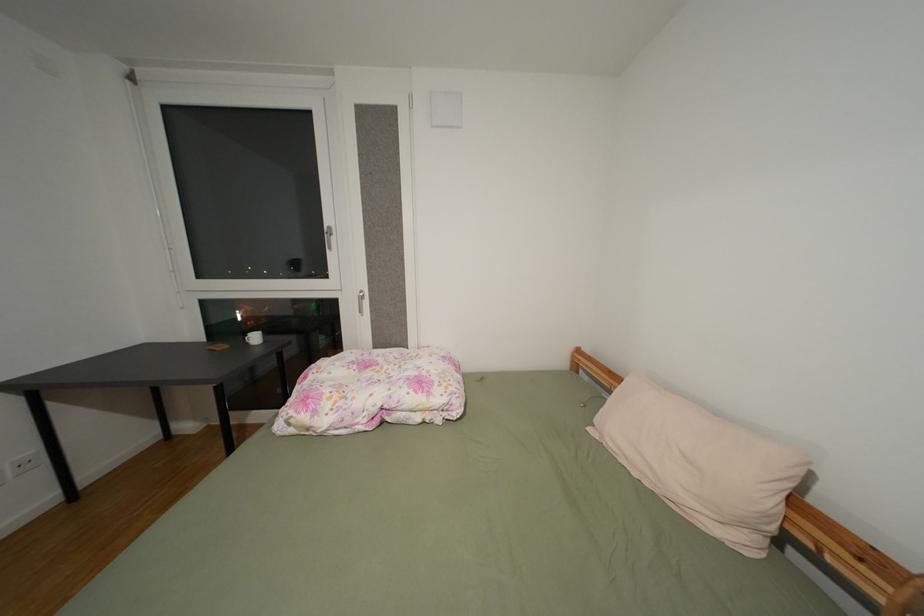
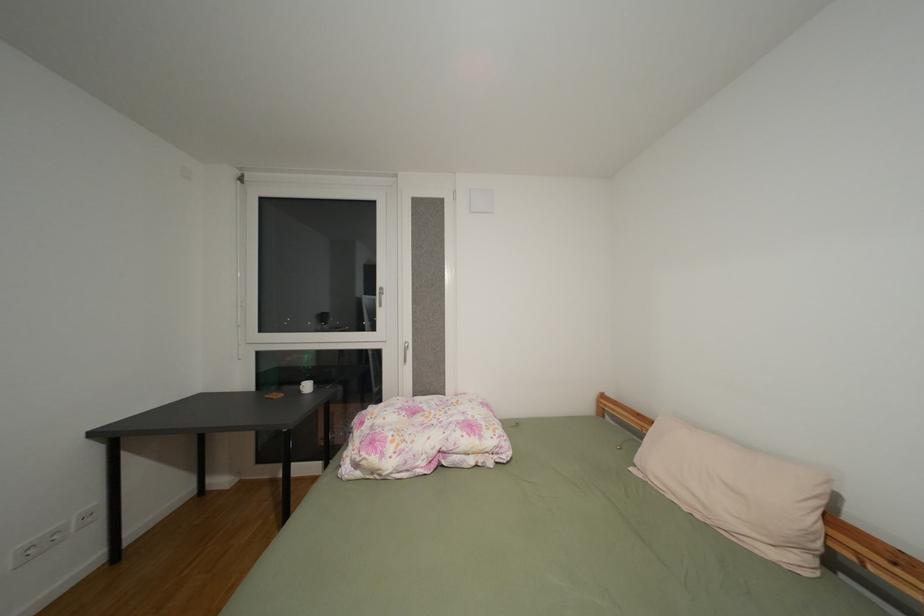
Which direction would the cameraman need to move to produce the second image?

The cameraman moved toward left, backward.